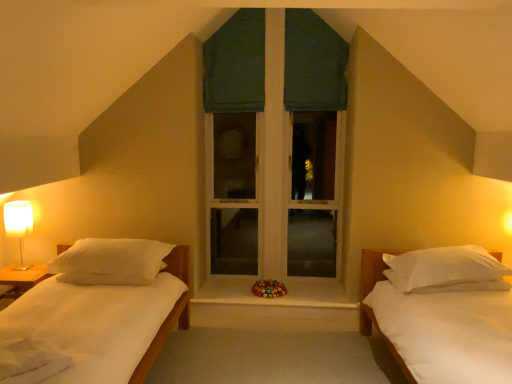
Question: Does white soft pillow at left, marked as the 1th pillow in a left-to-right arrangement, have a greater height compared to wooden at center?

Choices:
 (A) yes
 (B) no

Answer: (A)

Question: Is white soft pillow at left, which appears as the 2th pillow when viewed from the right, far from wooden at center?

Choices:
 (A) yes
 (B) no

Answer: (A)

Question: Is white soft pillow at left, which appears as the 2th pillow when viewed from the right, bigger than wooden at center?

Choices:
 (A) yes
 (B) no

Answer: (A)

Question: From the image's perspective, is white soft pillow at left, marked as the 1th pillow in a left-to-right arrangement, located above wooden at center?

Choices:
 (A) no
 (B) yes

Answer: (B)

Question: From a real-world perspective, is white soft pillow at left, which appears as the 2th pillow when viewed from the right, beneath wooden at center?

Choices:
 (A) yes
 (B) no

Answer: (B)

Question: Is point (287, 173) closer or farther from the camera than point (314, 26)?

Choices:
 (A) closer
 (B) farther

Answer: (B)

Question: Is green fabric window at center taller or shorter than green fabric curtain at upper center, acting as the first curtain starting from the right?

Choices:
 (A) short
 (B) tall

Answer: (B)

Question: Looking at the image, does green fabric window at center seem bigger or smaller compared to green fabric curtain at upper center, which is the 2th curtain in left-to-right order?

Choices:
 (A) small
 (B) big

Answer: (B)

Question: Choose the correct answer: Is green fabric window at center inside green fabric curtain at upper center, acting as the first curtain starting from the right, or outside it?

Choices:
 (A) outside
 (B) inside

Answer: (A)

Question: Considering their positions, is white matte bed at right located in front of or behind green fabric curtain at upper center, acting as the first curtain starting from the right?

Choices:
 (A) behind
 (B) front

Answer: (B)

Question: In terms of height, does white matte bed at right look taller or shorter compared to green fabric curtain at upper center, acting as the first curtain starting from the right?

Choices:
 (A) tall
 (B) short

Answer: (B)

Question: From the image's perspective, is white matte bed at right located above or below green fabric curtain at upper center, acting as the first curtain starting from the right?

Choices:
 (A) below
 (B) above

Answer: (A)

Question: Is point pyautogui.click(x=400, y=367) positioned closer to the camera than point pyautogui.click(x=321, y=41)?

Choices:
 (A) closer
 (B) farther

Answer: (A)

Question: Is point (245, 21) positioned closer to the camera than point (282, 301)?

Choices:
 (A) farther
 (B) closer

Answer: (A)

Question: Is dark green fabric at center, the first curtain positioned from the left, inside the boundaries of wooden at center, or outside?

Choices:
 (A) outside
 (B) inside

Answer: (A)